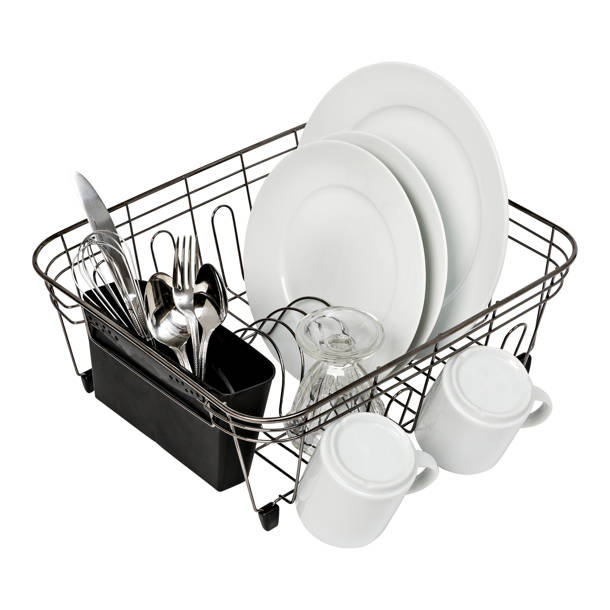
I want to click on spoons, so click(x=154, y=314), click(x=216, y=296).